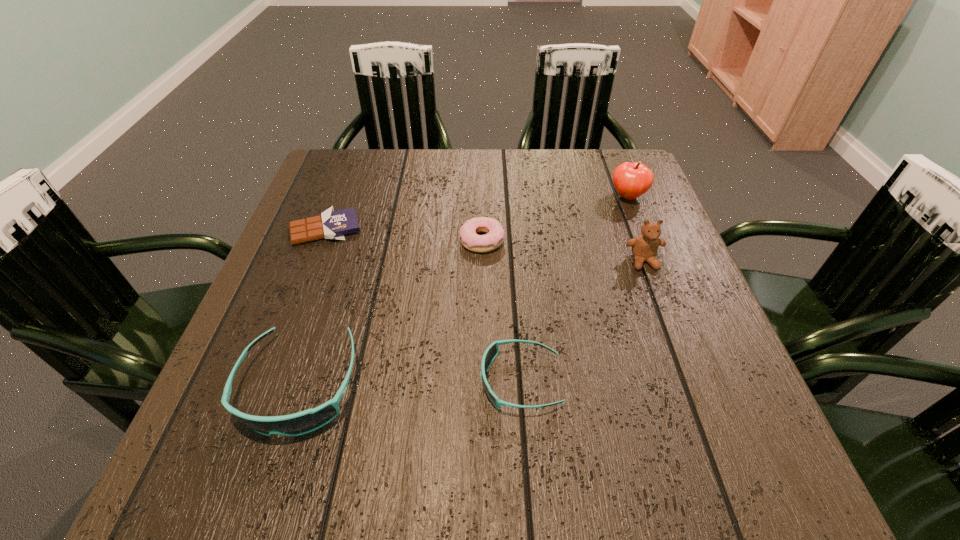
This screenshot has height=540, width=960. I want to click on the taller sunglasses, so click(x=303, y=422).

Where is `the third tallest object`? the third tallest object is located at coordinates (303, 422).

I want to click on the right sunglasses, so click(491, 352).

Find the location of a particular element. the shorter sunglasses is located at coordinates (491, 352).

Find the location of a particular element. The height and width of the screenshot is (540, 960). apple is located at coordinates (631, 180).

This screenshot has width=960, height=540. I want to click on the fifth tallest object, so click(x=494, y=238).

Locate an element on the screen. This screenshot has width=960, height=540. the shortest object is located at coordinates (331, 224).

Find the location of a particular element. This screenshot has width=960, height=540. teddy bear is located at coordinates (644, 247).

This screenshot has width=960, height=540. Find the location of `free space located on the front-facing side of the right sunglasses`. free space located on the front-facing side of the right sunglasses is located at coordinates (279, 381).

Where is `vacant area located on the front-facing side of the right sunglasses`? The width and height of the screenshot is (960, 540). vacant area located on the front-facing side of the right sunglasses is located at coordinates (434, 381).